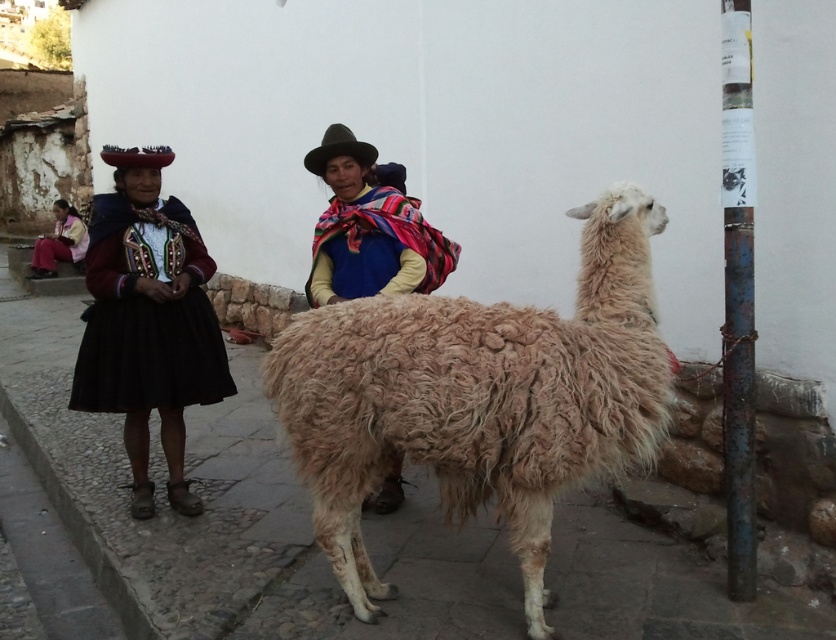
Is fuzzy beige alpaca at center in front of black velvet dress at left?

Yes, it is in front of black velvet dress at left.

Between fuzzy beige alpaca at center and black velvet dress at left, which one appears on the left side from the viewer's perspective?

Positioned to the left is black velvet dress at left.

Is point (457, 442) positioned behind point (72, 387)?

No, it is not.

What are the coordinates of `fuzzy beige alpaca at center` in the screenshot? It's located at (480, 397).

From the picture: Which is more to the right, fuzzy beige alpaca at center or multicolored woven shawl at center?

Positioned to the right is fuzzy beige alpaca at center.

Between point (622, 404) and point (362, 195), which one is positioned in front?

Point (622, 404) is in front.

At what (x,y) coordinates should I click in order to perform the action: click on fuzzy beige alpaca at center. Please return your answer as a coordinate pair (x, y). Looking at the image, I should click on (480, 397).

Who is more forward, (350,195) or (319,173)?

Point (350,195) is in front.

Is multicolored woven shawl at center wider than brown felt cowboy hat at center?

Indeed, multicolored woven shawl at center has a greater width compared to brown felt cowboy hat at center.

The height and width of the screenshot is (640, 836). I want to click on multicolored woven shawl at center, so click(x=370, y=227).

Locate an element on the screen. Image resolution: width=836 pixels, height=640 pixels. multicolored woven shawl at center is located at coordinates (370, 227).